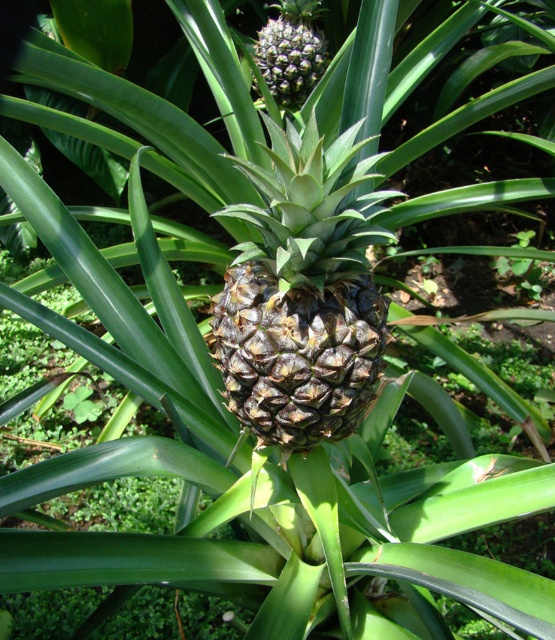
You are a farmer inspecting a pineapple plant. You notice two pineapples at the center of the plant. One is labeled as brown rough pineapple at center and the other is spongy brown pineapple at center. Which pineapple has a greater width?

The brown rough pineapple at center has a greater width than the spongy brown pineapple at center according to the description.

Consider the image. You are a botanist examining two pineapples in the scene. The first is labeled as the brown rough pineapple at center, and the second is the spongy brown pineapple at center. Which of these two pineapples is larger?

The brown rough pineapple at center is bigger than the spongy brown pineapple at center.